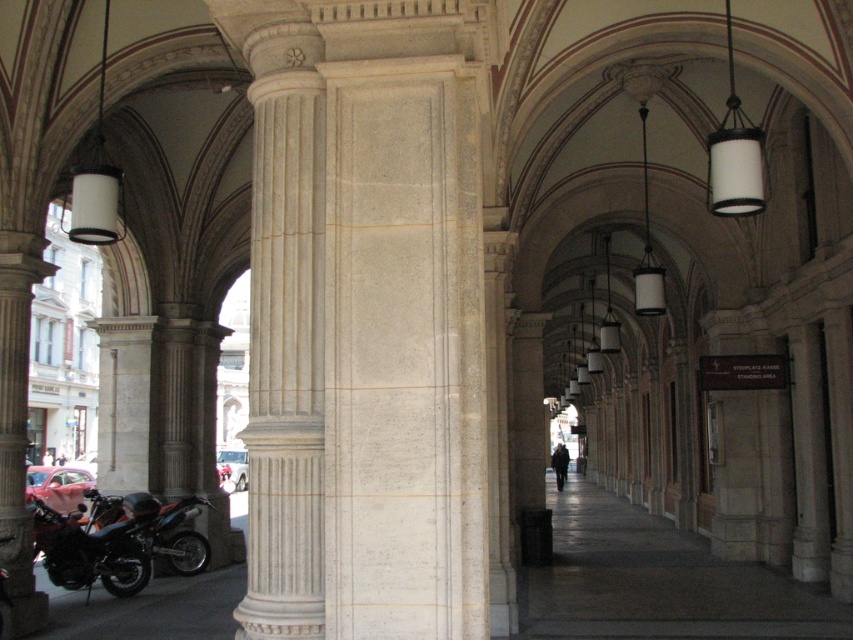
Question: Among these objects, which one is nearest to the camera?

Choices:
 (A) orange metallic motorcycle at lower left
 (B) shiny metallic motorcycle at lower left

Answer: (A)

Question: Is orange metallic motorcycle at lower left closer to the viewer compared to shiny metallic motorcycle at lower left?

Choices:
 (A) yes
 (B) no

Answer: (A)

Question: Is orange metallic motorcycle at lower left bigger than shiny metallic motorcycle at lower left?

Choices:
 (A) no
 (B) yes

Answer: (B)

Question: Can you confirm if orange metallic motorcycle at lower left is positioned above shiny metallic motorcycle at lower left?

Choices:
 (A) yes
 (B) no

Answer: (B)

Question: Among these points, which one is nearest to the camera?

Choices:
 (A) (186, 536)
 (B) (109, 584)

Answer: (B)